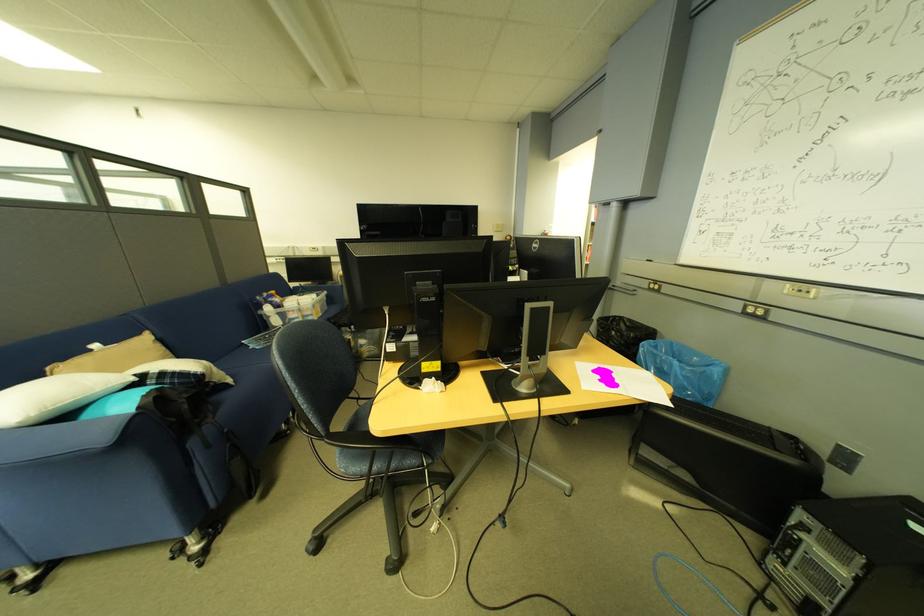
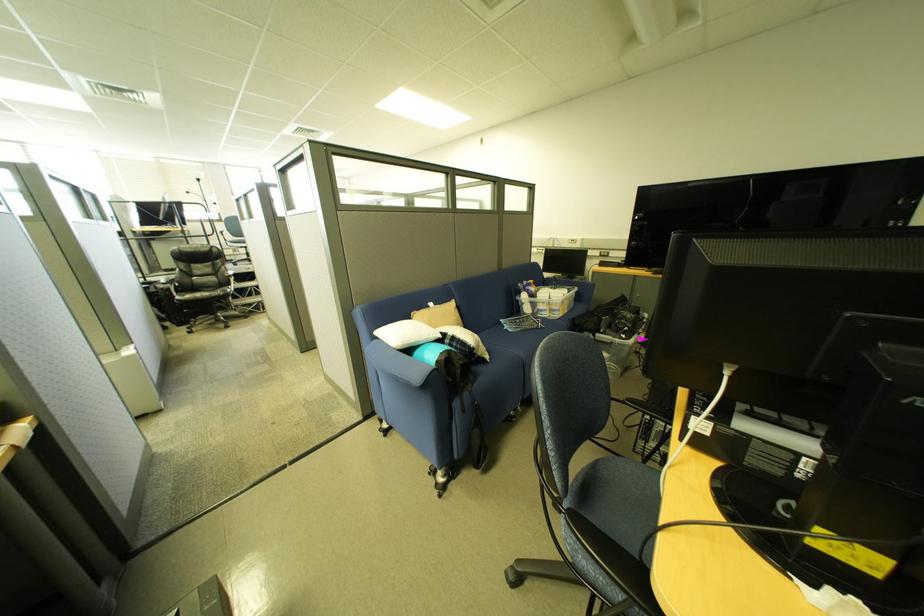
Locate, in the second image, the point that corresponds to point 378,408 in the first image.

(623, 467)